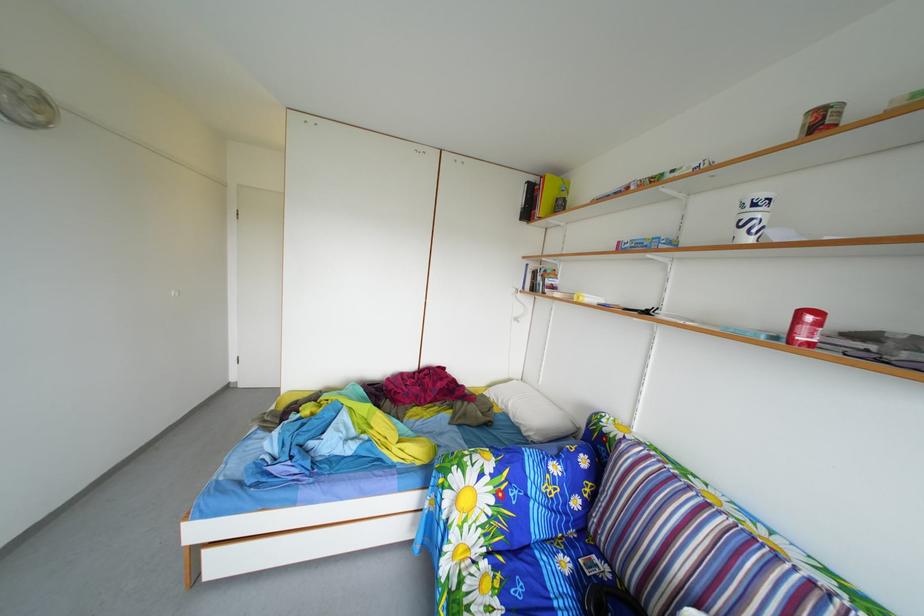
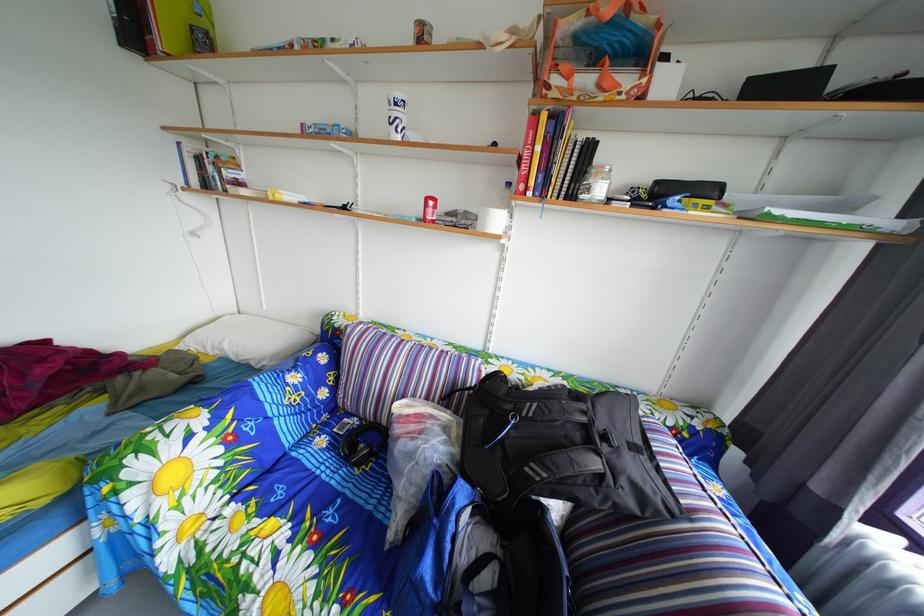
The point at (x=617, y=577) is marked in the first image. Where is the corresponding point in the second image?

(367, 428)